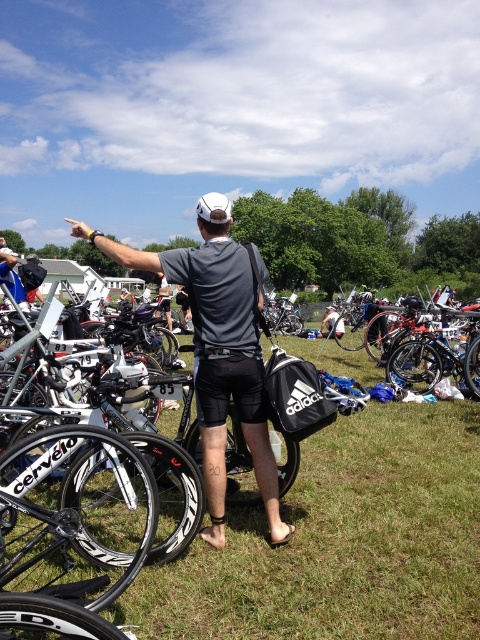
You are a photographer standing at the edge of the scene. You need to capture a photo where both the green grass at center and the shiny black bicycle at center are clearly visible. Which object should you focus on first to ensure both are in frame?

The green grass at center is not as tall as the shiny black bicycle at center, so you should focus on the shiny black bicycle at center first to ensure both are in frame.